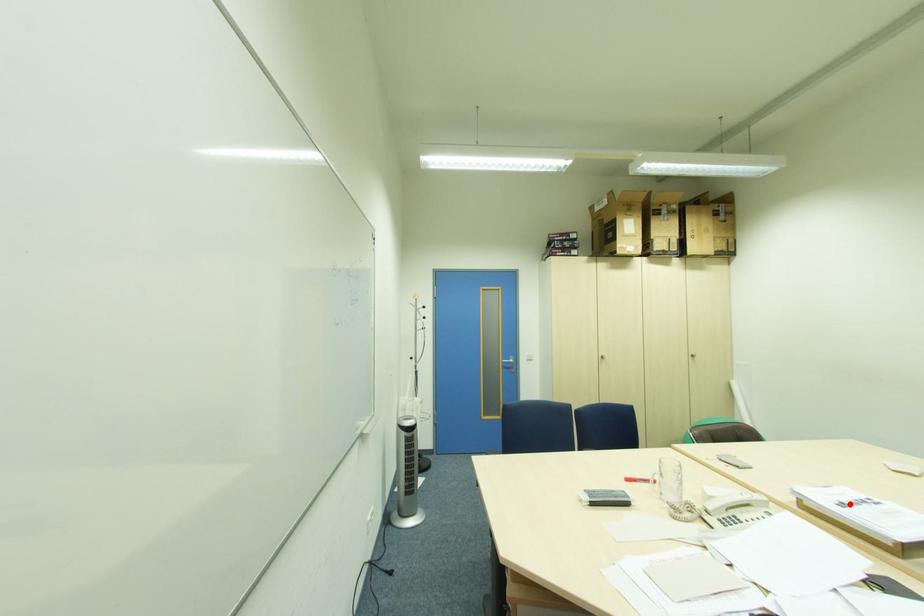
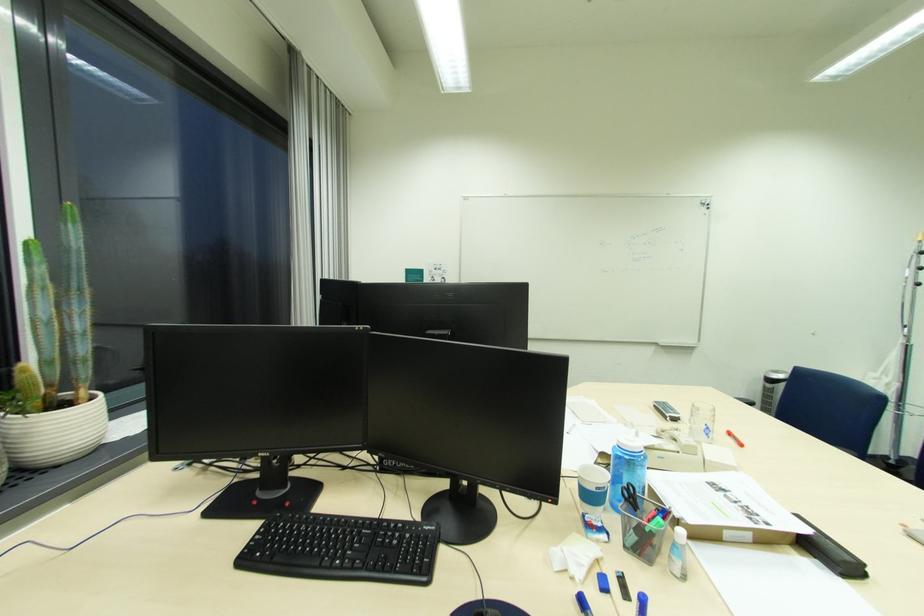
Locate, in the second image, the point that corresponds to the highlighted location in the first image.

(731, 491)